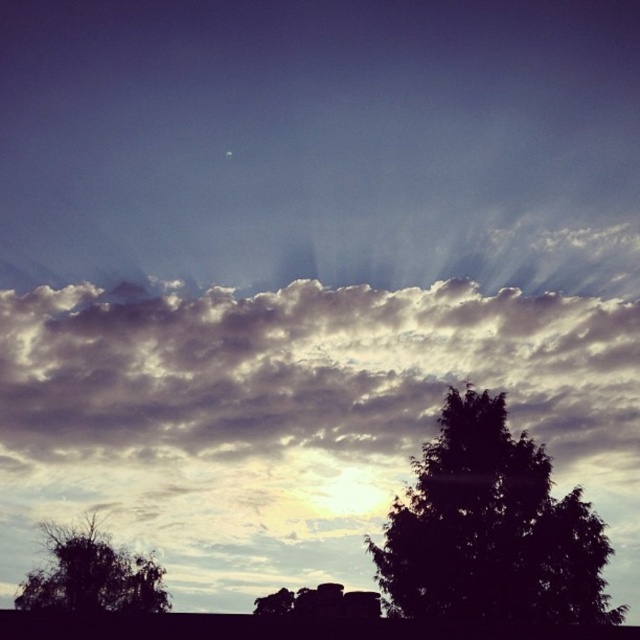
Question: Is cloudy sky at upper center bigger than dark green leafy tree at lower right?

Choices:
 (A) yes
 (B) no

Answer: (A)

Question: Does dark green leafy tree at lower right appear on the left side of silhouette leafy tree at lower left?

Choices:
 (A) no
 (B) yes

Answer: (A)

Question: Observing the image, what is the correct spatial positioning of cloudy sky at upper center in reference to silhouette leafy tree at lower left?

Choices:
 (A) below
 (B) above

Answer: (B)

Question: Among these objects, which one is nearest to the camera?

Choices:
 (A) dark green leafy tree at lower right
 (B) silhouette leafy tree at lower left
 (C) cloudy sky at upper center

Answer: (A)

Question: Among these objects, which one is farthest from the camera?

Choices:
 (A) silhouette leafy tree at lower left
 (B) dark green leafy tree at lower right

Answer: (A)

Question: Which point is farther to the camera?

Choices:
 (A) (413, 568)
 (B) (116, 577)
 (C) (387, 310)

Answer: (C)